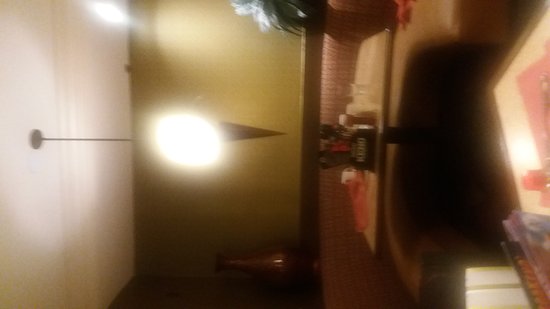
Locate an element on the screen. This screenshot has height=309, width=550. table is located at coordinates (384, 89).